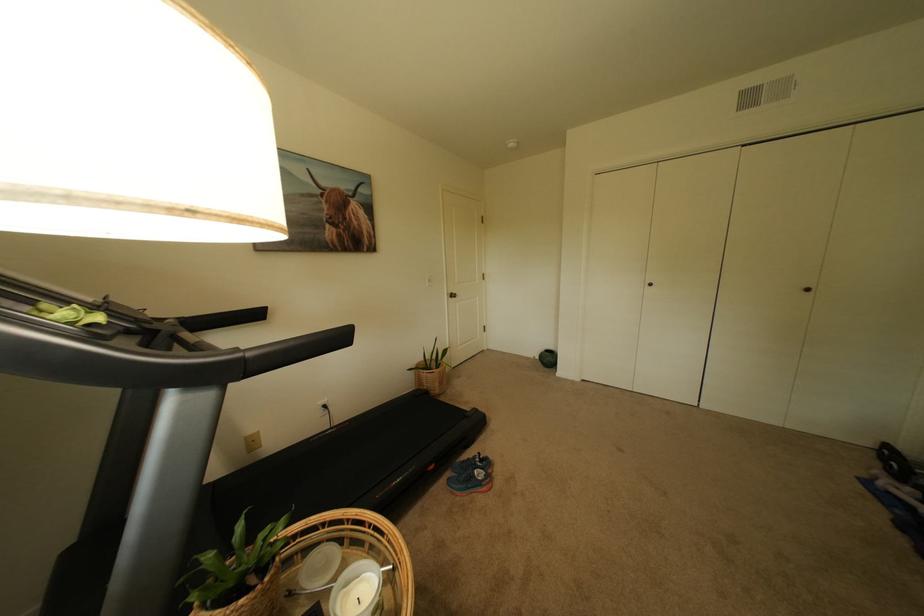
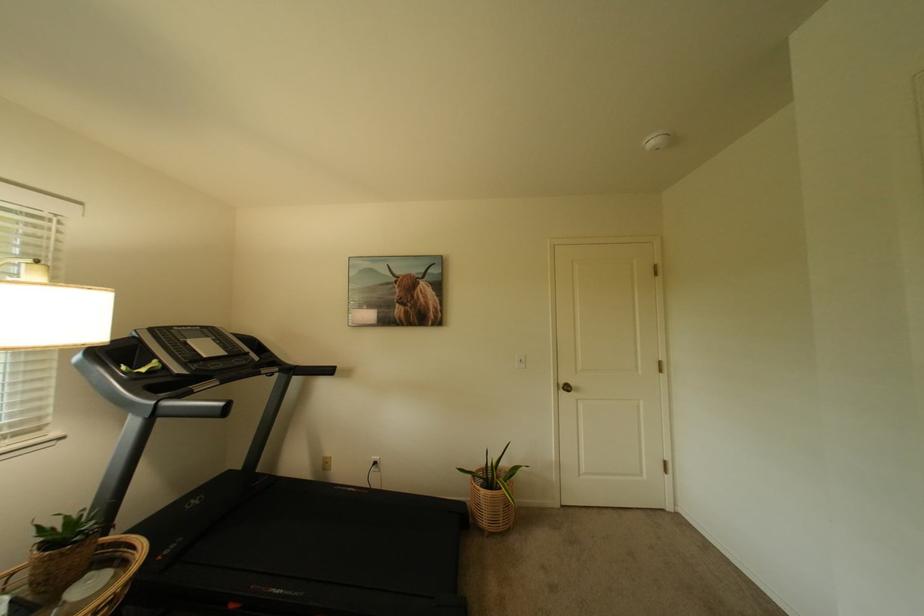
Find the pixel in the second image that matches point 446,385 in the first image.

(495, 515)